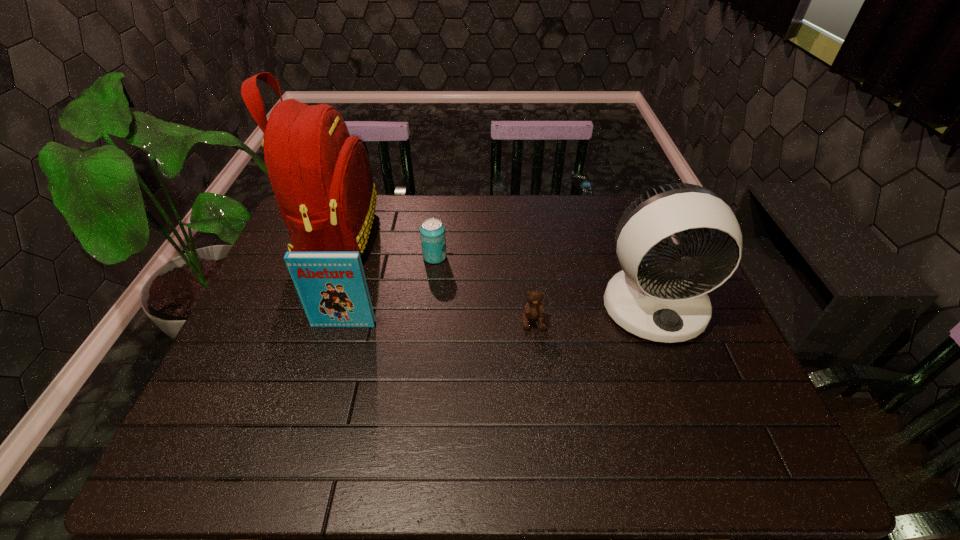
At what (x,y) coordinates should I click in order to perform the action: click on the tallest object. Please return your answer as a coordinate pair (x, y). This screenshot has height=540, width=960. Looking at the image, I should click on (321, 176).

I want to click on fan, so click(664, 299).

The image size is (960, 540). I want to click on the second tallest object, so click(664, 299).

You are a GUI agent. You are given a task and a screenshot of the screen. Output one action in this format:
    pyautogui.click(x=<x>, y=<y>)
    Task: Click on the book
    
    Given the screenshot: What is the action you would take?
    pyautogui.click(x=332, y=287)

Locate an element on the screen. This screenshot has width=960, height=540. the third object from left to right is located at coordinates (432, 231).

Locate an element on the screen. This screenshot has height=540, width=960. beer can is located at coordinates (432, 231).

The height and width of the screenshot is (540, 960). I want to click on the shortest object, so click(534, 309).

I want to click on teddy bear, so click(x=534, y=309).

You are a GUI agent. You are given a task and a screenshot of the screen. Output one action in this format:
    pyautogui.click(x=<x>, y=<y>)
    Task: Click on the vacant point located 0.080m on the front-facing side of the tallest object
    
    Given the screenshot: What is the action you would take?
    pyautogui.click(x=401, y=236)

The height and width of the screenshot is (540, 960). I want to click on vacant region located on the grille of the rightmost object, so click(x=694, y=414).